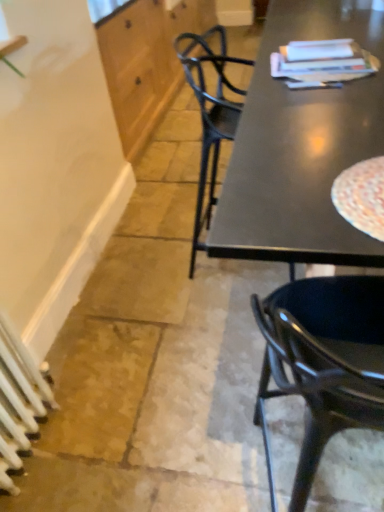
Identify the location of empty space that is to the right of white metallic radiator at lower left. The image size is (384, 512). (90, 438).